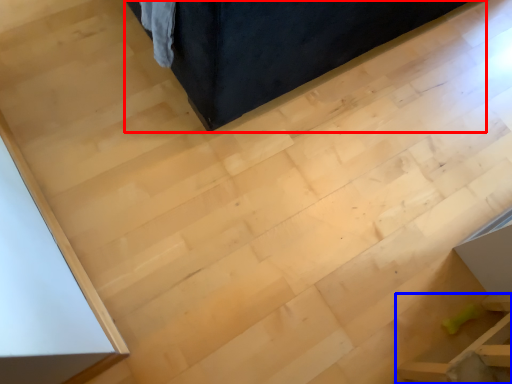
Question: Which point is further to the camera, furniture (highlighted by a red box) or furniture (highlighted by a blue box)?

Choices:
 (A) furniture
 (B) furniture

Answer: (A)